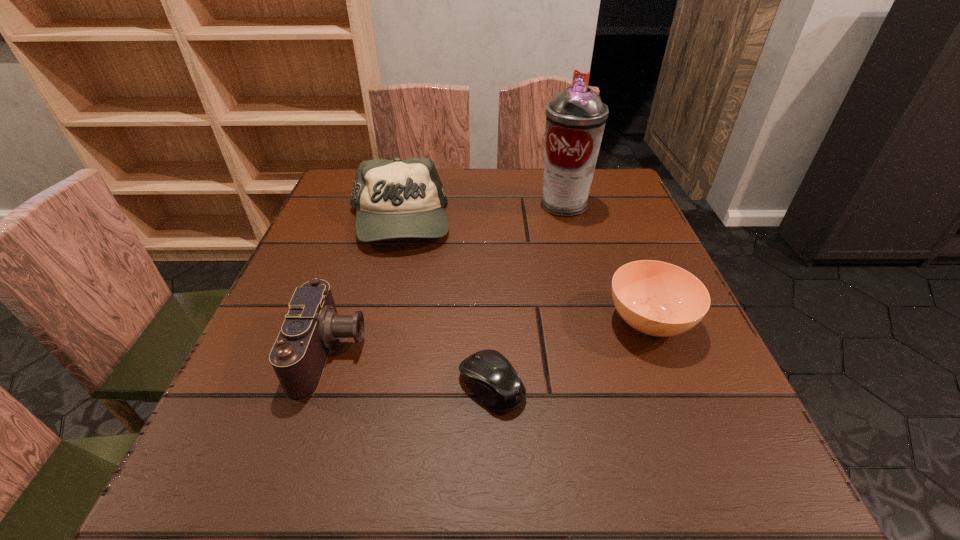
At what (x,y) coordinates should I click in order to perform the action: click on free spot that satisfies the following two spatial constraints: 1. on the front-facing side of the baseball cap; 2. on the left side of the fourth tallest object. Please return your answer as a coordinate pair (x, y). This screenshot has width=960, height=540. Looking at the image, I should click on (373, 321).